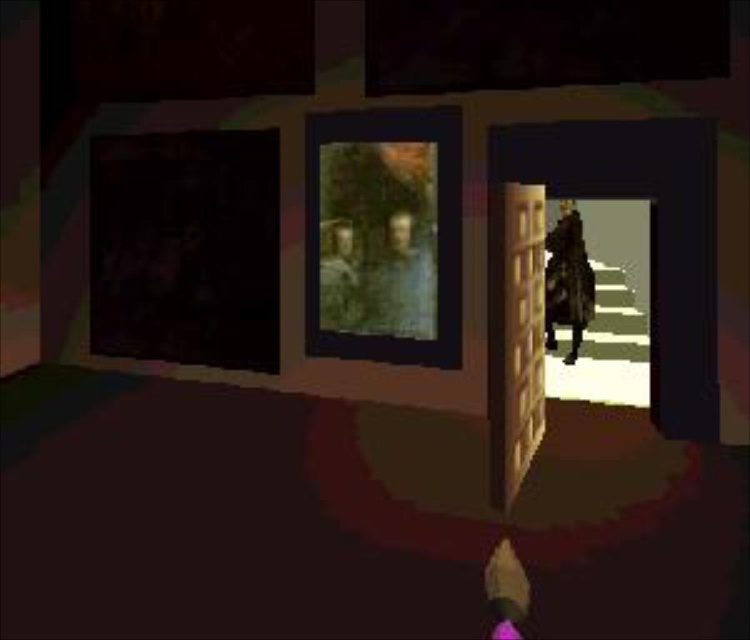
In the video game screenshot, you see a character holding a glowing purple object at the bottom center. There is a point marked at coordinates (404, 282). Based on the scene description, where is this point located?

The point marked at coordinates (404, 282) is on the olive green fabric portrait at center.

You are playing a video game and see a point marked at coordinates (x=402, y=264) in the scene. If you need to reach this point quickly, how far will you have to travel from your current position?

The point at (x=402, y=264) is 5.97 meters away from you, so you would need to travel approximately 5.97 meters to reach it.

You are playing a video game and need to pick up the leather jacket at center. Your character is currently 20 feet away from it. Can you reach it without moving closer?

The leather jacket at center is 23.38 feet away from the camera, so your character cannot reach it without moving closer since they are currently 20 feet away.